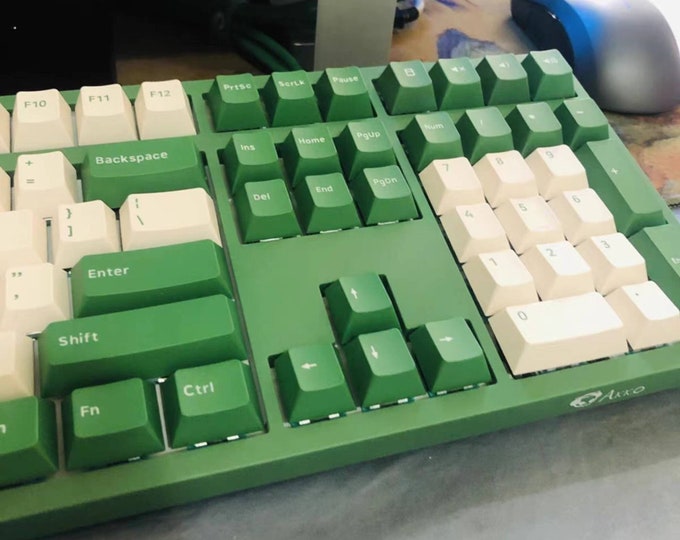
This screenshot has height=540, width=680. Identify the location of keyboard. (301, 252).